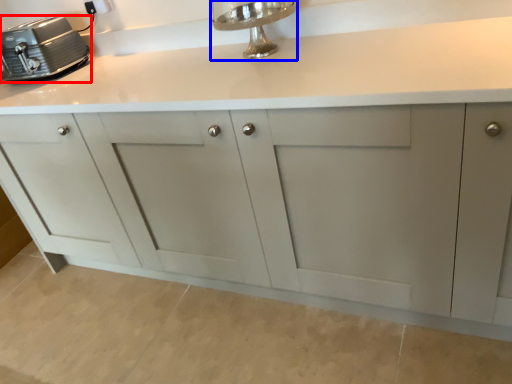
Question: Which of the following is the farthest to the observer, home appliance (highlighted by a red box) or faucet (highlighted by a blue box)?

Choices:
 (A) home appliance
 (B) faucet

Answer: (A)